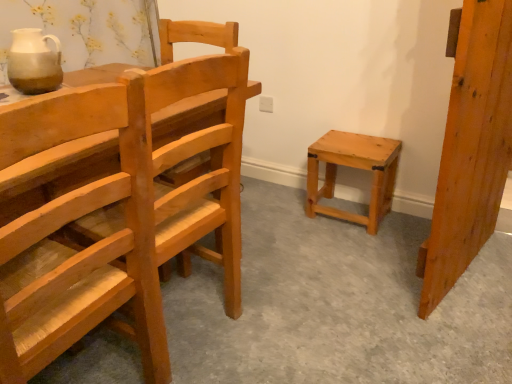
Locate an element on the screen. free space in front of natural wood stool at center-right is located at coordinates (358, 242).